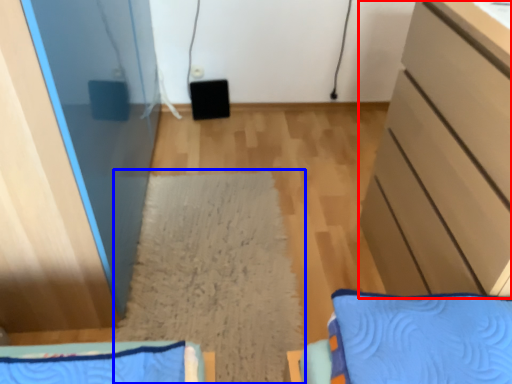
Question: Which object appears farthest to the camera in this image, cabinetry (highlighted by a red box) or mat (highlighted by a blue box)?

Choices:
 (A) cabinetry
 (B) mat

Answer: (B)